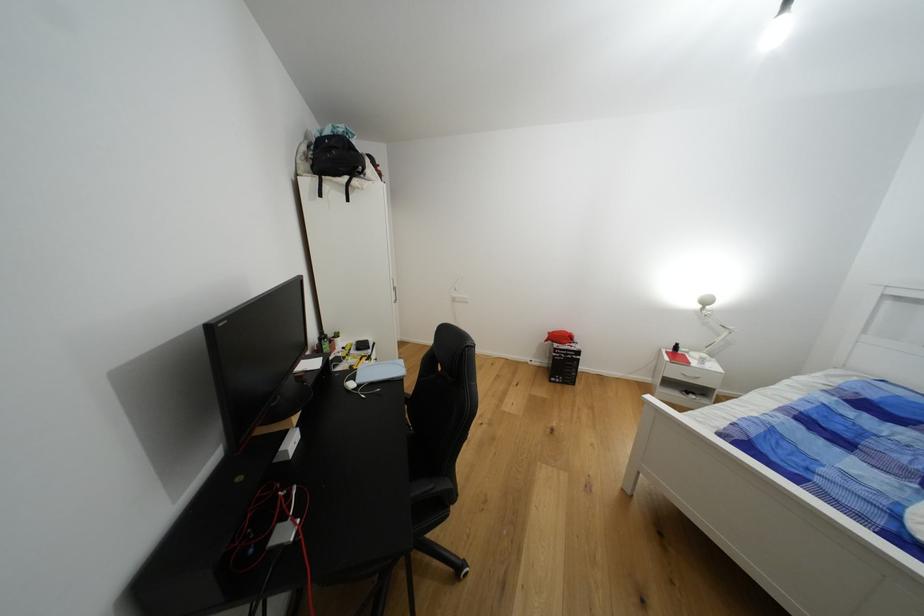
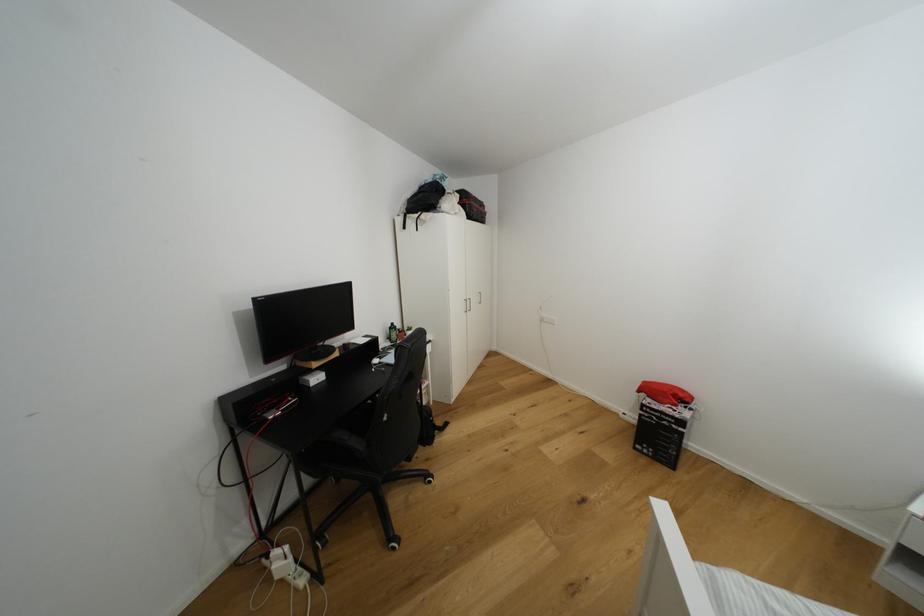
In the second image, find the point that corresponds to point 555,383 in the first image.

(639, 450)